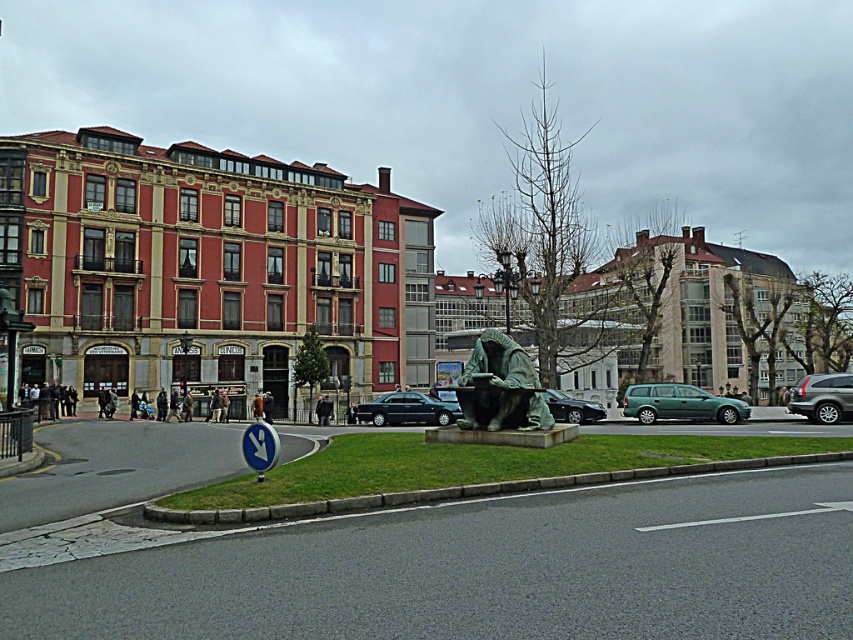
Who is lower down, green patina statue at center or green matte van at center?

green matte van at center

From the picture: Is green patina statue at center to the right of green matte van at center from the viewer's perspective?

In fact, green patina statue at center is to the left of green matte van at center.

Locate an element on the screen. The width and height of the screenshot is (853, 640). green patina statue at center is located at coordinates (500, 387).

Is green stone statue at center further to the viewer compared to green matte van at center?

No, it is not.

Does green stone statue at center appear on the left side of green matte van at center?

Yes, green stone statue at center is to the left of green matte van at center.

Which is behind, point (351, 556) or point (676, 384)?

The point (676, 384) is behind.

The width and height of the screenshot is (853, 640). Find the location of `green stone statue at center`. green stone statue at center is located at coordinates (416, 554).

Consider the image. Does green matte van at center appear on the left side of green metallic car at center?

In fact, green matte van at center is to the right of green metallic car at center.

Is green matte van at center closer to camera compared to green metallic car at center?

No, it is not.

I want to click on green matte van at center, so click(x=680, y=403).